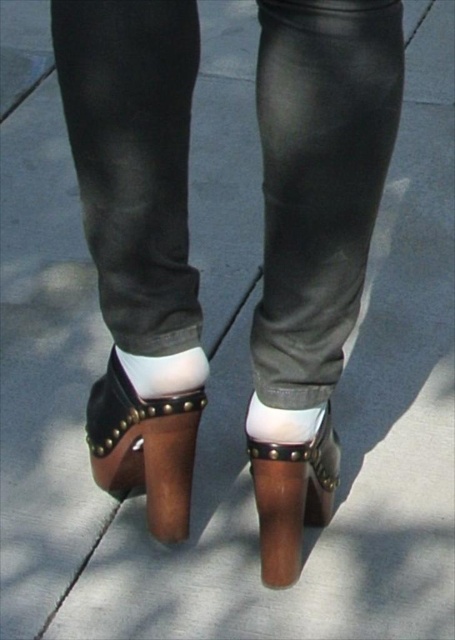
You are a fashion designer creating a new shoe design. You have the brown leather sandal at center and the white matte sock at center in front of you. Which item should you choose if you want to use a larger piece as the base for your design?

The brown leather sandal at center is larger in size than the white matte sock at center, so you should choose the brown leather sandal at center as the base for your design.

You are standing 1 meter away from a table. You want to place a small object on the table without moving your feet. Can you reach the table with your hand if the table is at the same distance as the white smooth socks at center?

The white smooth socks at center are 1.03 meters away from the viewer. Since the table is at the same distance, and the average human arm length is about 0.7 meters, you cannot reach the table without moving your feet.

Based on the photo, please provide the 2D coordinates of the brown leather sandal at center in the image.

The brown leather sandal at center is located at the 2D coordinates of point (x=145, y=448).